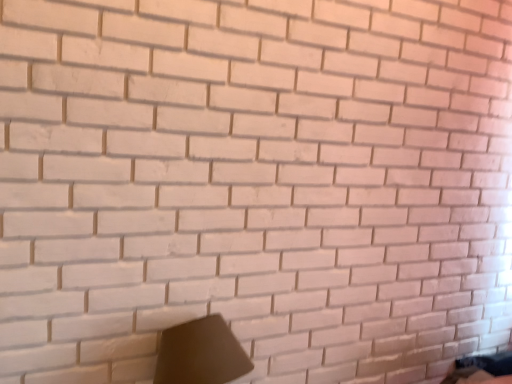
Measure the distance between matte black lampshade at lower center and camera.

matte black lampshade at lower center and camera are 1.08 meters apart from each other.

The height and width of the screenshot is (384, 512). What are the coordinates of `matte black lampshade at lower center` in the screenshot? It's located at (200, 353).

What do you see at coordinates (200, 353) in the screenshot? This screenshot has height=384, width=512. I see `matte black lampshade at lower center` at bounding box center [200, 353].

This screenshot has height=384, width=512. I want to click on matte black lampshade at lower center, so click(200, 353).